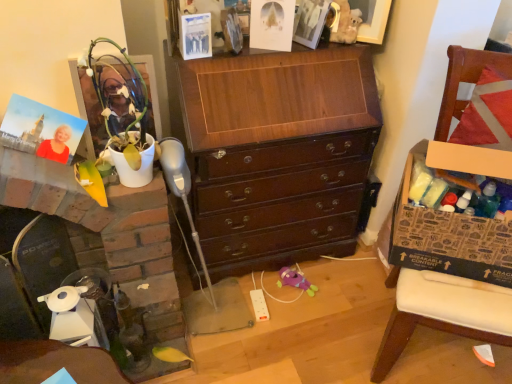
Question: Does white glossy fireplace at left have a greater width compared to brown cardboard box at right?

Choices:
 (A) yes
 (B) no

Answer: (A)

Question: Considering the relative sizes of white glossy fireplace at left and brown cardboard box at right in the image provided, is white glossy fireplace at left bigger than brown cardboard box at right?

Choices:
 (A) yes
 (B) no

Answer: (A)

Question: Would you say brown cardboard box at right is part of white glossy fireplace at left's contents?

Choices:
 (A) no
 (B) yes

Answer: (A)

Question: Does white glossy fireplace at left appear on the left side of brown cardboard box at right?

Choices:
 (A) yes
 (B) no

Answer: (A)

Question: Does white glossy fireplace at left touch brown cardboard box at right?

Choices:
 (A) no
 (B) yes

Answer: (A)

Question: Does white glossy fireplace at left have a smaller size compared to brown cardboard box at right?

Choices:
 (A) yes
 (B) no

Answer: (B)

Question: Would you consider white glossy fireplace at left to be distant from matte plastic picture frame at upper left, which is the 2th picture frame from right to left?

Choices:
 (A) yes
 (B) no

Answer: (B)

Question: From the image's perspective, is white glossy fireplace at left under matte plastic picture frame at upper left, positioned as the second picture frame in back-to-front order?

Choices:
 (A) yes
 (B) no

Answer: (A)

Question: From a real-world perspective, is white glossy fireplace at left over matte plastic picture frame at upper left, positioned as the second picture frame in back-to-front order?

Choices:
 (A) no
 (B) yes

Answer: (A)

Question: Would you say matte plastic picture frame at upper left, which is the 2th picture frame from right to left, is part of white glossy fireplace at left's contents?

Choices:
 (A) no
 (B) yes

Answer: (A)

Question: Is white glossy fireplace at left at the left side of matte plastic picture frame at upper left, which is the 2th picture frame from right to left?

Choices:
 (A) yes
 (B) no

Answer: (A)

Question: Considering the relative sizes of white glossy fireplace at left and matte plastic picture frame at upper left, positioned as the 1th picture frame in bottom-to-top order, in the image provided, is white glossy fireplace at left thinner than matte plastic picture frame at upper left, positioned as the 1th picture frame in bottom-to-top order,?

Choices:
 (A) yes
 (B) no

Answer: (B)

Question: From the image's perspective, would you say shiny dark wood chest of drawers at center is positioned over white glossy fireplace at left?

Choices:
 (A) no
 (B) yes

Answer: (B)